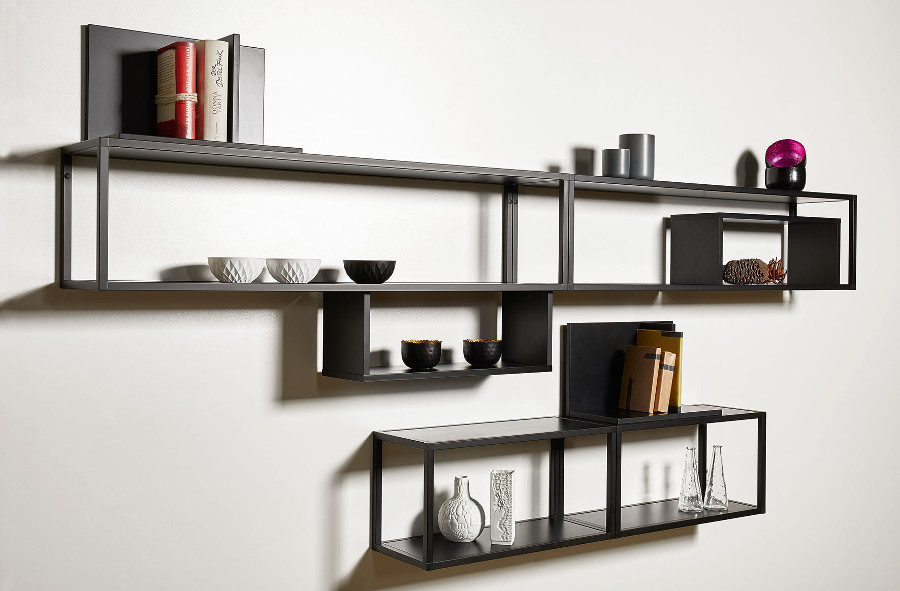
This screenshot has width=900, height=591. In order to click on book in this screenshot , I will do `click(653, 389)`, `click(662, 376)`, `click(671, 368)`, `click(680, 357)`, `click(184, 105)`, `click(209, 95)`, `click(230, 70)`.